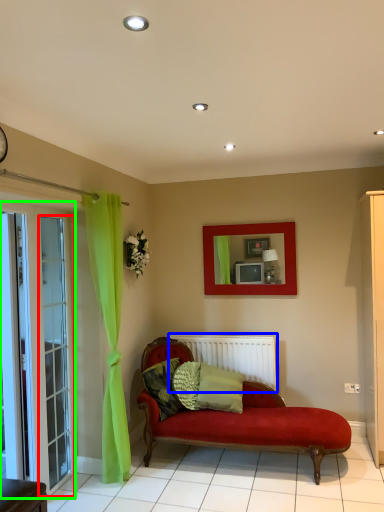
Question: Considering the real-world distances, which object is closest to glass door (highlighted by a red box)? radiator (highlighted by a blue box) or screen door (highlighted by a green box).

Choices:
 (A) radiator
 (B) screen door

Answer: (B)